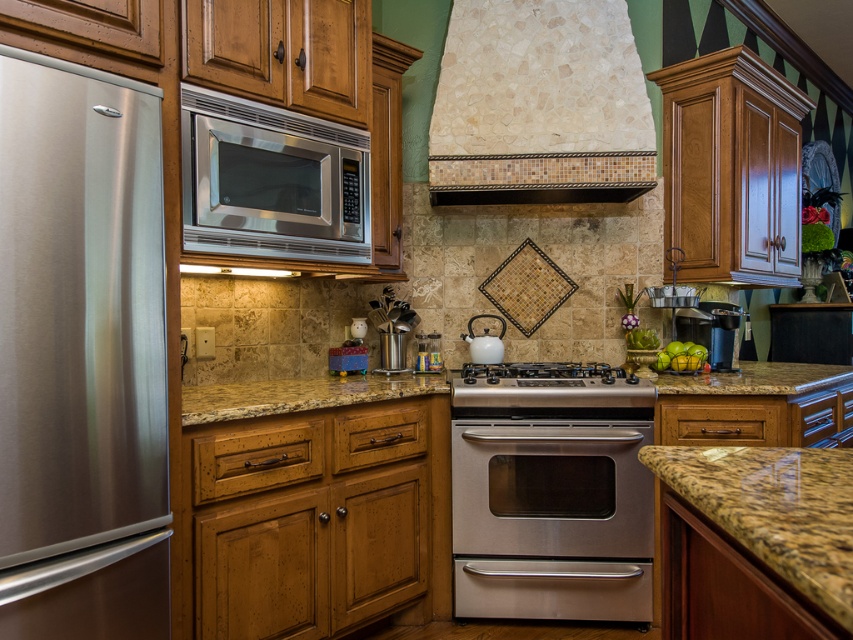
Question: Which point is farther to the camera?

Choices:
 (A) stainless steel gas stove at center
 (B) stainless steel oven at center

Answer: (A)

Question: Is stainless steel refrigerator at left above stainless steel oven at center?

Choices:
 (A) yes
 (B) no

Answer: (A)

Question: Does brown granite countertop at lower right appear on the left side of satin silver microwave at upper center?

Choices:
 (A) no
 (B) yes

Answer: (A)

Question: Based on their relative distances, which object is nearer to the stainless steel refrigerator at left?

Choices:
 (A) stainless steel gas stove at center
 (B) brown granite countertop at lower right
 (C) granite at center

Answer: (C)

Question: Estimate the real-world distances between objects in this image. Which object is farther from the granite at center?

Choices:
 (A) mosaic tile exhaust hood at upper center
 (B) stainless steel refrigerator at left
 (C) brown granite countertop at lower right
 (D) stainless steel oven at center

Answer: (C)

Question: Can you confirm if stainless steel refrigerator at left is positioned to the right of stainless steel oven at center?

Choices:
 (A) yes
 (B) no

Answer: (B)